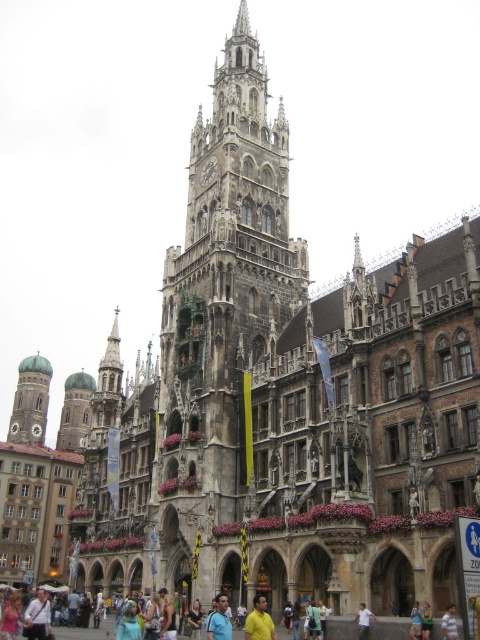
Who is lower down, light blue shirt at center or white cotton shirt at center?

white cotton shirt at center

Between light blue shirt at center and white cotton shirt at center, which one is positioned higher?

light blue shirt at center is higher up.

Which is behind, point (453, 636) or point (365, 634)?

The point (365, 634) is behind.

You are a GUI agent. You are given a task and a screenshot of the screen. Output one action in this format:
    pyautogui.click(x=<x>, y=<y>)
    Task: Click on the light blue shirt at center
    
    Given the screenshot: What is the action you would take?
    pyautogui.click(x=450, y=621)

Which is in front, point (26, 424) or point (269, 621)?

Point (269, 621) is more forward.

Does green copper dome at left have a smaller size compared to yellow shirt at center?

Incorrect, green copper dome at left is not smaller in size than yellow shirt at center.

Who is more distant from viewer, (35, 412) or (276, 636)?

Point (35, 412)

Identify the location of green copper dome at left. [31, 401].

How much distance is there between yellow shirt at center and light blue shirt at center?

yellow shirt at center is 11.21 meters from light blue shirt at center.

Is yellow shirt at center above light blue shirt at center?

No, yellow shirt at center is not above light blue shirt at center.

Identify the location of yellow shirt at center. (260, 621).

At what (x,y) coordinates should I click in order to perform the action: click on yellow shirt at center. Please return your answer as a coordinate pair (x, y). This screenshot has width=480, height=640. Looking at the image, I should click on (260, 621).